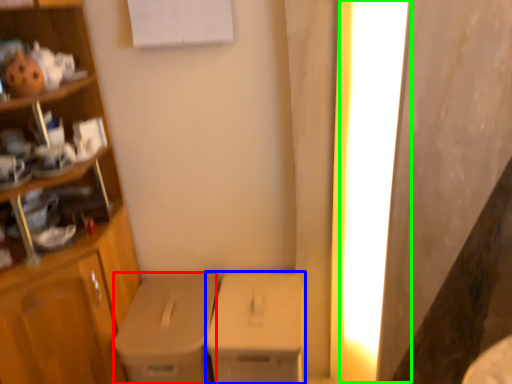
Question: Which is nearer to the cardboard box (highlighted by a red box)? cardboard box (highlighted by a blue box) or lighting (highlighted by a green box).

Choices:
 (A) cardboard box
 (B) lighting

Answer: (A)